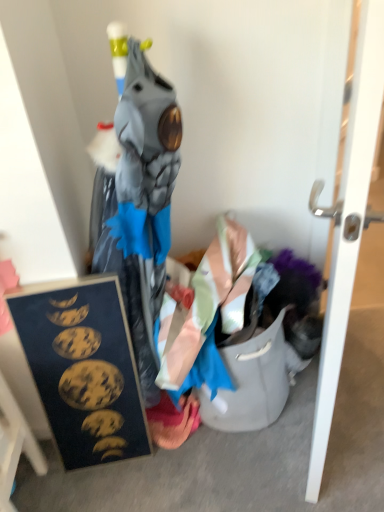
Question: Does wooden frame at lower left have a greater height compared to white glossy door at right?

Choices:
 (A) yes
 (B) no

Answer: (B)

Question: From the image's perspective, would you say wooden frame at lower left is shown under white glossy door at right?

Choices:
 (A) yes
 (B) no

Answer: (A)

Question: Is wooden frame at lower left with white glossy door at right?

Choices:
 (A) no
 (B) yes

Answer: (A)

Question: From a real-world perspective, is wooden frame at lower left on white glossy door at right?

Choices:
 (A) no
 (B) yes

Answer: (A)

Question: Does wooden frame at lower left lie in front of white glossy door at right?

Choices:
 (A) no
 (B) yes

Answer: (A)

Question: Is wooden frame at lower left looking in the opposite direction of white glossy door at right?

Choices:
 (A) yes
 (B) no

Answer: (A)

Question: Does wooden frame at lower left have a larger size compared to pink fabric at lower center?

Choices:
 (A) yes
 (B) no

Answer: (A)

Question: Does wooden frame at lower left come in front of pink fabric at lower center?

Choices:
 (A) yes
 (B) no

Answer: (A)

Question: Considering the relative sizes of wooden frame at lower left and pink fabric at lower center in the image provided, is wooden frame at lower left wider than pink fabric at lower center?

Choices:
 (A) no
 (B) yes

Answer: (A)

Question: Is wooden frame at lower left turned away from pink fabric at lower center?

Choices:
 (A) yes
 (B) no

Answer: (A)

Question: Is wooden frame at lower left directly adjacent to pink fabric at lower center?

Choices:
 (A) no
 (B) yes

Answer: (A)

Question: Considering the relative sizes of wooden frame at lower left and pink fabric at lower center in the image provided, is wooden frame at lower left thinner than pink fabric at lower center?

Choices:
 (A) no
 (B) yes

Answer: (B)

Question: Is white glossy door at right turned away from pink fabric at lower center?

Choices:
 (A) yes
 (B) no

Answer: (A)